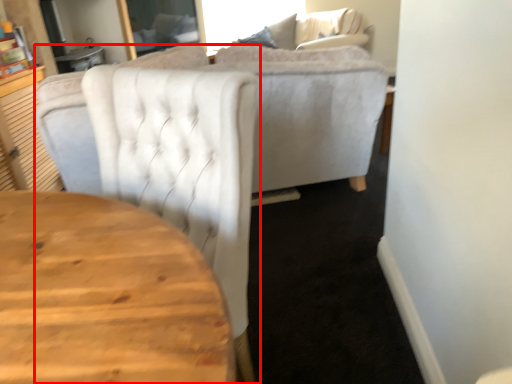
Question: From the image's perspective, considering the relative positions of chair (annotated by the red box) and couch in the image provided, where is chair (annotated by the red box) located with respect to the staircase?

Choices:
 (A) above
 (B) below

Answer: (B)